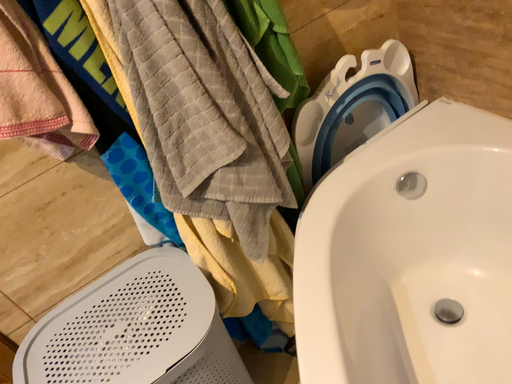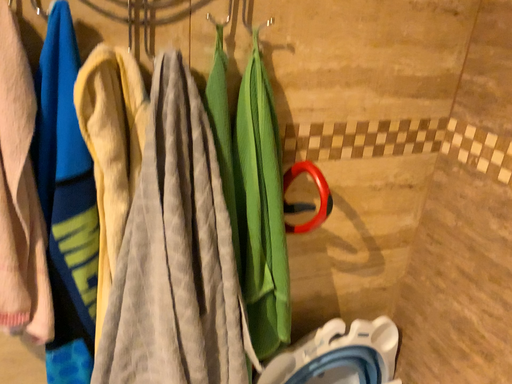
Question: Which way did the camera rotate in the video?

Choices:
 (A) rotated upward
 (B) rotated downward

Answer: (A)